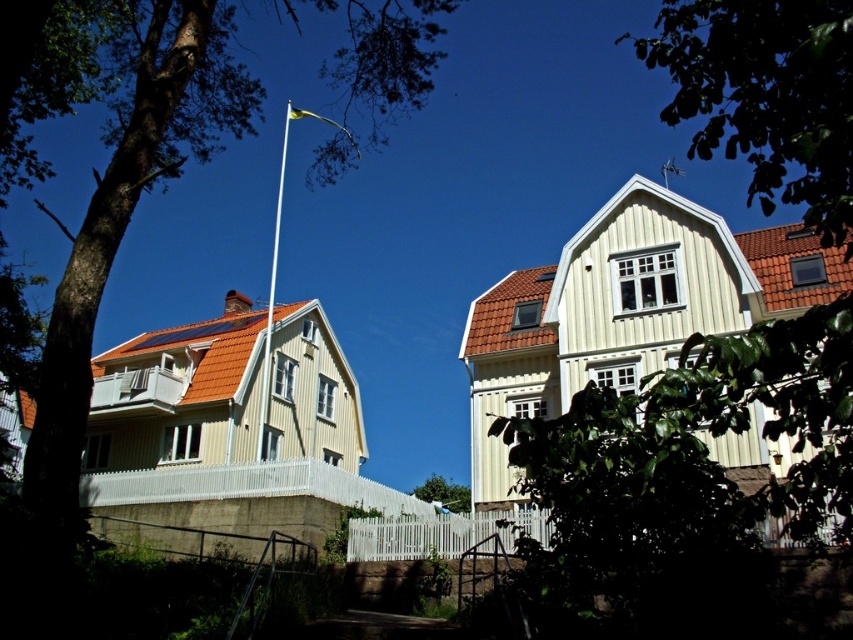
Question: From the image, what is the correct spatial relationship of metallic flag pole at upper center in relation to metallic flagpole at upper center?

Choices:
 (A) above
 (B) below

Answer: (B)

Question: Which object appears closest to the camera in this image?

Choices:
 (A) brown textured tree at upper left
 (B) metallic flagpole at upper center
 (C) metallic flag pole at upper center
 (D) green leafy tree at center

Answer: (A)

Question: Does metallic flag pole at upper center have a larger size compared to metallic flagpole at upper center?

Choices:
 (A) no
 (B) yes

Answer: (B)

Question: Does brown textured tree at upper left have a smaller size compared to metallic flag pole at upper center?

Choices:
 (A) yes
 (B) no

Answer: (B)

Question: Which is farther from the green leafy tree at center?

Choices:
 (A) brown textured tree at upper left
 (B) metallic flagpole at upper center

Answer: (A)

Question: Which point is closer to the camera taking this photo?

Choices:
 (A) (436, 509)
 (B) (80, 275)

Answer: (B)